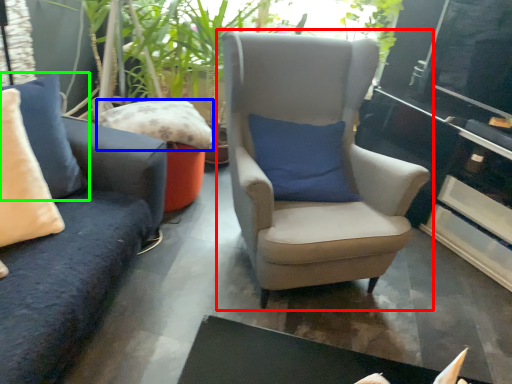
Question: Which object is positioned farthest from chair (highlighted by a red box)? Select from pillow (highlighted by a blue box) and pillow (highlighted by a green box).

Choices:
 (A) pillow
 (B) pillow

Answer: (B)